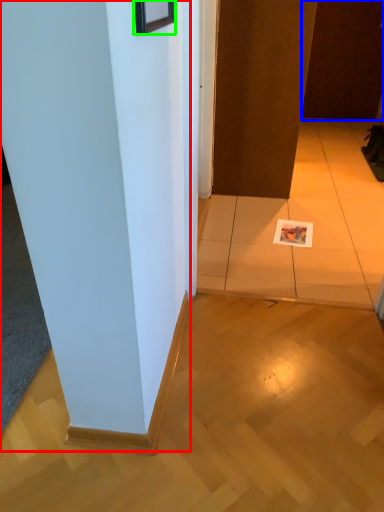
Question: Considering the real-world distances, which object is farthest from pillar (highlighted by a red box)? door (highlighted by a blue box) or picture frame (highlighted by a green box)?

Choices:
 (A) door
 (B) picture frame

Answer: (A)